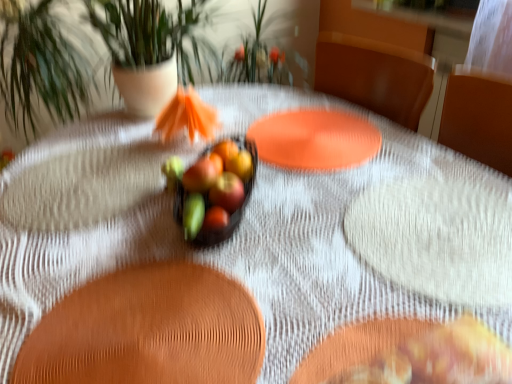
Question: Based on their positions, is green matte apple at center, the 2th fruit from the front, located to the left or right of glossy glass bowl at center, the 3th fruit when ordered from bottom to top?

Choices:
 (A) right
 (B) left

Answer: (B)

Question: Is point (172, 185) positioned closer to the camera than point (232, 155)?

Choices:
 (A) closer
 (B) farther

Answer: (A)

Question: Considering the real-world distances, which object is closest to the green leafy plant at center?

Choices:
 (A) glossy red apple at center, placed as the third fruit when sorted from back to front
 (B) glossy ceramic grapefruit at center
 (C) glossy apple at center, arranged as the first apple when viewed from the back
 (D) green matte flower at center
 (E) green matte apple at center, placed as the 2th fruit when sorted from bottom to top

Answer: (E)

Question: Which of these objects is positioned closest to the green matte flower at center?

Choices:
 (A) green leafy plant at center
 (B) golden-brown crispy pastry at lower right
 (C) green matte apple at center, the 2th fruit from the front
 (D) glossy apple at center, arranged as the first apple when viewed from the back
 (E) glossy glass bowl at center, the 3th fruit when ordered from bottom to top

Answer: (C)